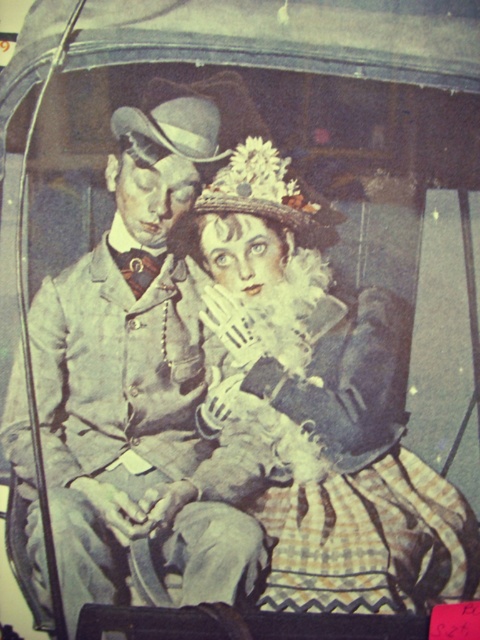
Is point (382, 408) behind point (193, 540)?

Yes, point (382, 408) is behind point (193, 540).

Describe the element at coordinates (314, 408) in the screenshot. I see `matte black dress at center` at that location.

Where is `matte black dress at center`? The width and height of the screenshot is (480, 640). matte black dress at center is located at coordinates coord(314,408).